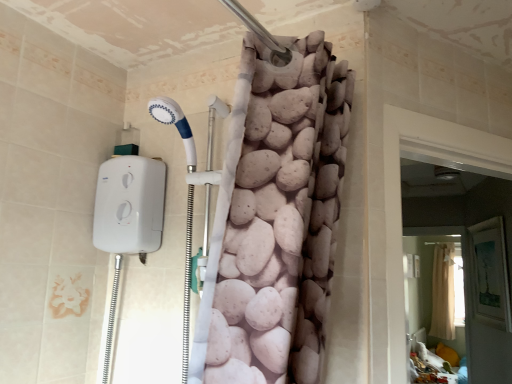
Question: From the image's perspective, is beige fabric screen door at lower right, which is counted as the 1th screen door, starting from the right, on top of white fabric screen door at right, acting as the second screen door starting from the right?

Choices:
 (A) no
 (B) yes

Answer: (A)

Question: Does beige fabric screen door at lower right, positioned as the first screen door in back-to-front order, have a greater height compared to white fabric screen door at right, placed as the first screen door when sorted from left to right?

Choices:
 (A) yes
 (B) no

Answer: (A)

Question: From a real-world perspective, is beige fabric screen door at lower right, the 2th screen door in the front-to-back sequence, positioned over white fabric screen door at right, placed as the first screen door when sorted from left to right, based on gravity?

Choices:
 (A) no
 (B) yes

Answer: (A)

Question: Is beige fabric screen door at lower right, positioned as the first screen door in back-to-front order, facing towards white fabric screen door at right, the 2th screen door from the back?

Choices:
 (A) no
 (B) yes

Answer: (B)

Question: Is beige fabric screen door at lower right, the 2th screen door in the front-to-back sequence, directly adjacent to white fabric screen door at right, placed as the 1th screen door when sorted from front to back?

Choices:
 (A) yes
 (B) no

Answer: (B)

Question: Considering the positions of beige fabric screen door at lower right, positioned as the first screen door in back-to-front order, and beige fabric shower curtain at upper center in the image, is beige fabric screen door at lower right, positioned as the first screen door in back-to-front order, wider or thinner than beige fabric shower curtain at upper center?

Choices:
 (A) thin
 (B) wide

Answer: (A)

Question: Is beige fabric screen door at lower right, which appears as the second screen door when viewed from the left, to the left or to the right of beige fabric shower curtain at upper center in the image?

Choices:
 (A) left
 (B) right

Answer: (A)

Question: In terms of height, does beige fabric screen door at lower right, which appears as the second screen door when viewed from the left, look taller or shorter compared to beige fabric shower curtain at upper center?

Choices:
 (A) tall
 (B) short

Answer: (B)

Question: From a real-world perspective, is beige fabric screen door at lower right, positioned as the first screen door in back-to-front order, physically located above or below beige fabric shower curtain at upper center?

Choices:
 (A) above
 (B) below

Answer: (B)

Question: Is beige fabric screen door at lower right, positioned as the first screen door in back-to-front order, situated inside white fabric screen door at right, acting as the second screen door starting from the right, or outside?

Choices:
 (A) inside
 (B) outside

Answer: (B)

Question: Looking at their shapes, would you say beige fabric screen door at lower right, the 2th screen door in the front-to-back sequence, is wider or thinner than white fabric screen door at right, acting as the second screen door starting from the right?

Choices:
 (A) wide
 (B) thin

Answer: (B)

Question: In the image, is beige fabric screen door at lower right, the 2th screen door in the front-to-back sequence, positioned in front of or behind white fabric screen door at right, placed as the 1th screen door when sorted from front to back?

Choices:
 (A) front
 (B) behind

Answer: (B)

Question: From their relative heights in the image, would you say beige fabric screen door at lower right, the 2th screen door in the front-to-back sequence, is taller or shorter than white fabric screen door at right, acting as the second screen door starting from the right?

Choices:
 (A) short
 (B) tall

Answer: (B)

Question: From the image's perspective, relative to white fabric screen door at right, the 2th screen door from the back, is beige fabric shower curtain at upper center above or below?

Choices:
 (A) above
 (B) below

Answer: (B)

Question: Is beige fabric shower curtain at upper center taller or shorter than white fabric screen door at right, acting as the second screen door starting from the right?

Choices:
 (A) tall
 (B) short

Answer: (A)